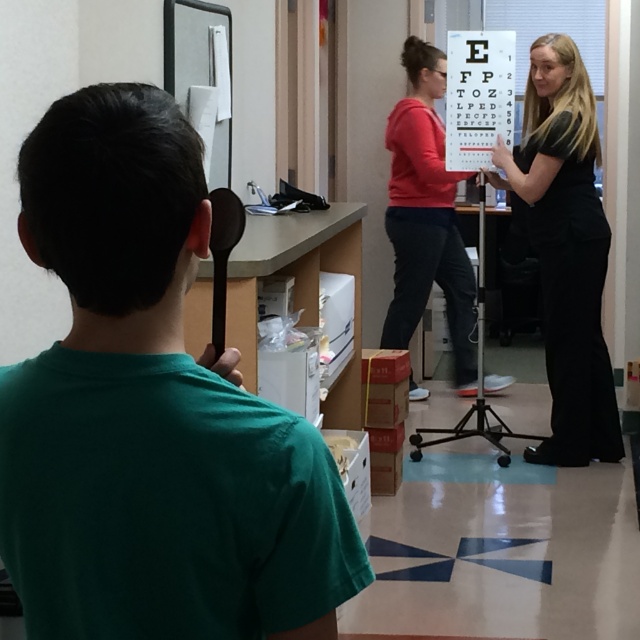
The height and width of the screenshot is (640, 640). In order to click on green matte shirt at center in this screenshot , I will do `click(150, 412)`.

In the scene shown: Which is below, green matte shirt at center or matte red shirt at center?

green matte shirt at center

Which is behind, point (308, 438) or point (433, 61)?

Point (433, 61)

Find the location of a particular element. green matte shirt at center is located at coordinates coord(150,412).

Can you confirm if black smooth dress at right is positioned below matte red shirt at center?

Yes, black smooth dress at right is below matte red shirt at center.

Can you confirm if black smooth dress at right is wider than matte red shirt at center?

Incorrect, black smooth dress at right's width does not surpass matte red shirt at center's.

Measure the distance between black smooth dress at right and camera.

A distance of 14.69 feet exists between black smooth dress at right and camera.

Locate an element on the screen. This screenshot has height=640, width=640. black smooth dress at right is located at coordinates (564, 250).

Which is in front, point (19, 403) or point (548, 317)?

Point (19, 403) is in front.

Who is higher up, green matte shirt at center or black smooth dress at right?

black smooth dress at right is higher up.

Does point (4, 413) come closer to viewer compared to point (602, 211)?

Yes, point (4, 413) is in front of point (602, 211).

You are a GUI agent. You are given a task and a screenshot of the screen. Output one action in this format:
    pyautogui.click(x=<x>, y=<y>)
    Task: Click on the green matte shirt at center
    
    Given the screenshot: What is the action you would take?
    pyautogui.click(x=150, y=412)